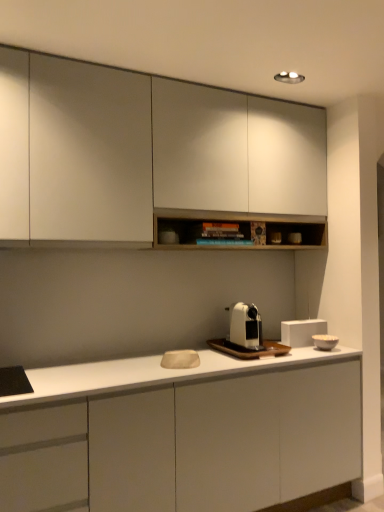
Question: In terms of width, does matte white cabinet at upper center, which is the 2th cabinetry in bottom-to-top order, look wider or thinner when compared to white matte cabinet at center, which appears as the second cabinetry when viewed from the top?

Choices:
 (A) thin
 (B) wide

Answer: (A)

Question: In terms of size, does matte white cabinet at upper center, which is counted as the first cabinetry, starting from the top, appear bigger or smaller than white matte cabinet at center, marked as the 1th cabinetry in a bottom-to-top arrangement?

Choices:
 (A) small
 (B) big

Answer: (A)

Question: Which object is the closest to the white matte bowl at right, placed as the 2th appliance when sorted from back to front?

Choices:
 (A) white matte coffee machine at center
 (B) white matte rectangular box at center, the second appliance positioned from the front
 (C) matte white cabinet at upper center, which is the 2th cabinetry in bottom-to-top order
 (D) white matte cabinet at center, marked as the 1th cabinetry in a bottom-to-top arrangement

Answer: (B)

Question: Estimate the real-world distances between objects in this image. Which object is farther from the white matte bowl at right, placed as the 2th appliance when sorted from back to front?

Choices:
 (A) white matte coffee machine at center
 (B) white matte rectangular box at center, the second appliance positioned from the front
 (C) white matte cabinet at center, which appears as the second cabinetry when viewed from the top
 (D) matte white cabinet at upper center, which is the 2th cabinetry in bottom-to-top order

Answer: (D)